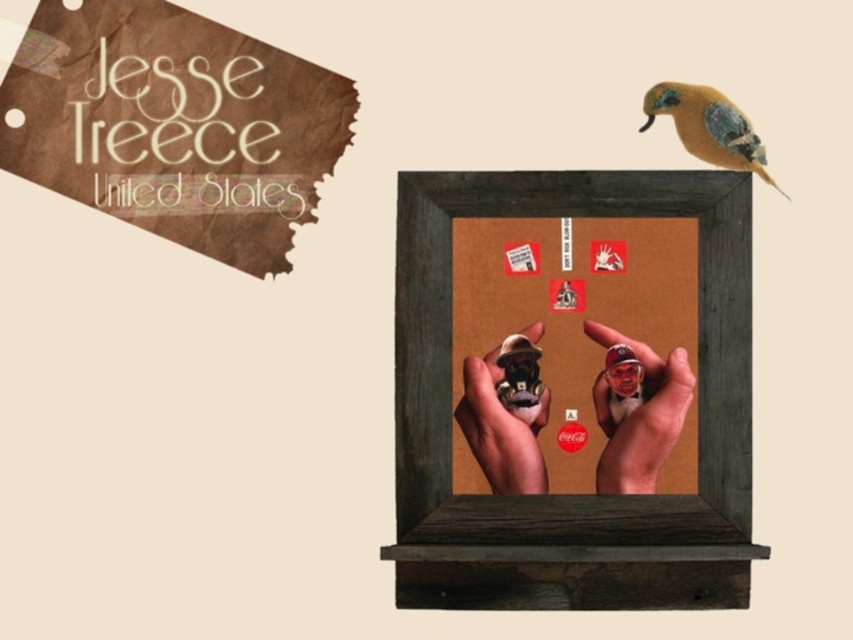
You are an artist analyzing the spatial relationships in this image. You notice two points marked at coordinates point (61, 1) and point (633, 440). Which point appears closer to you?

Point (61, 1) is further to the viewer than point (633, 440), so the first point is closer.

You are an art curator arranging a display. You need to place a new object between the brown paper at upper left and the matte brown figurine at center. Where should you position it to maintain the existing spatial relationship?

The new object should be placed between the brown paper at upper left and the matte brown figurine at center, ensuring it is to the right of the brown paper at upper left and to the left of the matte brown figurine at center, maintaining their original left to right order.